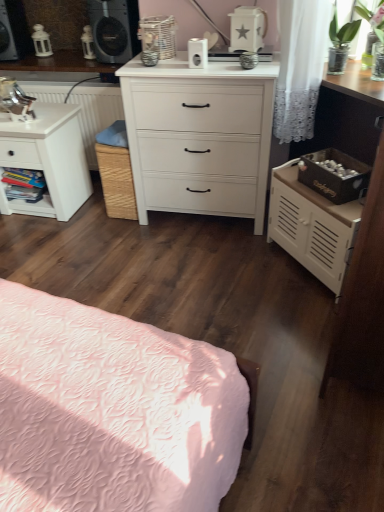
Question: Is the depth of white matte cabinet at right, placed as the second nightstand when sorted from left to right, greater than that of wooden bookshelf at left?

Choices:
 (A) yes
 (B) no

Answer: (B)

Question: Does white matte cabinet at right, placed as the second nightstand when sorted from left to right, have a greater height compared to wooden bookshelf at left?

Choices:
 (A) no
 (B) yes

Answer: (B)

Question: Considering the relative sizes of white matte cabinet at right, the first nightstand in the right-to-left sequence, and wooden bookshelf at left in the image provided, is white matte cabinet at right, the first nightstand in the right-to-left sequence, thinner than wooden bookshelf at left?

Choices:
 (A) yes
 (B) no

Answer: (B)

Question: Does white matte cabinet at right, placed as the second nightstand when sorted from left to right, contain wooden bookshelf at left?

Choices:
 (A) no
 (B) yes

Answer: (A)

Question: Does white matte cabinet at right, placed as the second nightstand when sorted from left to right, have a lesser height compared to wooden bookshelf at left?

Choices:
 (A) no
 (B) yes

Answer: (A)

Question: Considering the positions of matte black speaker at upper left, which is the 2th speaker from right to left, and white matte cabinet at right, placed as the second nightstand when sorted from left to right, in the image, is matte black speaker at upper left, which is the 2th speaker from right to left, taller or shorter than white matte cabinet at right, placed as the second nightstand when sorted from left to right,?

Choices:
 (A) tall
 (B) short

Answer: (B)

Question: Considering the relative positions of matte black speaker at upper left, which is the 2th speaker from right to left, and white matte cabinet at right, placed as the second nightstand when sorted from left to right, in the image provided, is matte black speaker at upper left, which is the 2th speaker from right to left, to the left or to the right of white matte cabinet at right, placed as the second nightstand when sorted from left to right,?

Choices:
 (A) left
 (B) right

Answer: (A)

Question: Choose the correct answer: Is matte black speaker at upper left, the 1th speaker from the left, inside white matte cabinet at right, placed as the second nightstand when sorted from left to right, or outside it?

Choices:
 (A) outside
 (B) inside

Answer: (A)

Question: In the image, is matte black speaker at upper left, the 1th speaker from the left, positioned in front of or behind white matte cabinet at right, placed as the second nightstand when sorted from left to right?

Choices:
 (A) behind
 (B) front

Answer: (A)

Question: Considering the positions of point (92, 0) and point (4, 2), is point (92, 0) closer or farther from the camera than point (4, 2)?

Choices:
 (A) farther
 (B) closer

Answer: (B)

Question: In terms of width, does matte black speaker at upper center, marked as the first speaker in a right-to-left arrangement, look wider or thinner when compared to matte black speaker at upper left, the 1th speaker from the left?

Choices:
 (A) thin
 (B) wide

Answer: (B)

Question: From their relative heights in the image, would you say matte black speaker at upper center, marked as the first speaker in a right-to-left arrangement, is taller or shorter than matte black speaker at upper left, the 1th speaker from the left?

Choices:
 (A) tall
 (B) short

Answer: (B)

Question: Is matte black speaker at upper center, which is counted as the 2th speaker, starting from the left, bigger or smaller than matte black speaker at upper left, which is the 2th speaker from right to left?

Choices:
 (A) big
 (B) small

Answer: (A)

Question: From a real-world perspective, is white matte nightstand at left, the 2th nightstand positioned from the right, above or below matte black speaker at upper left, which is the 2th speaker from right to left?

Choices:
 (A) below
 (B) above

Answer: (A)

Question: Visually, is white matte nightstand at left, the 1th nightstand in the left-to-right sequence, positioned to the left or to the right of matte black speaker at upper left, the 1th speaker from the left?

Choices:
 (A) right
 (B) left

Answer: (A)